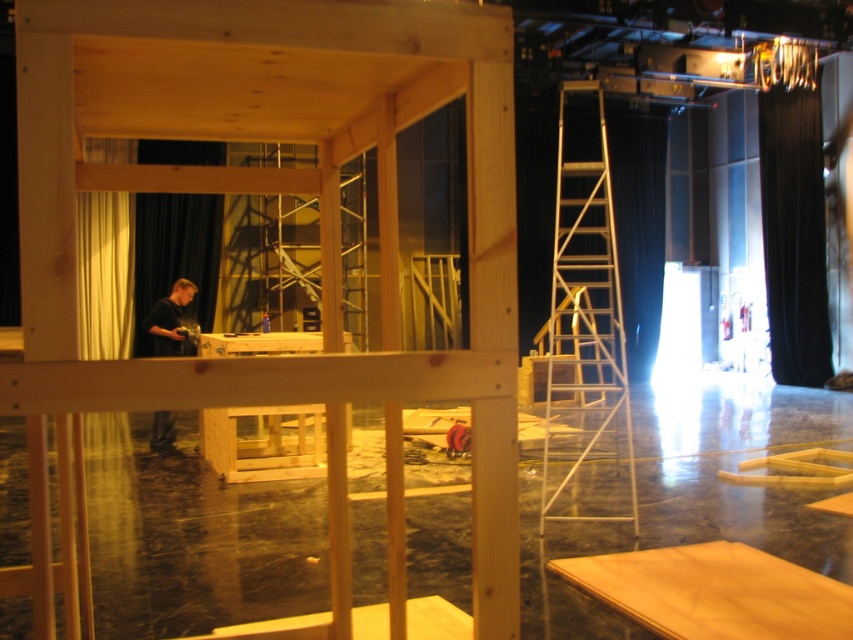
You are standing in the construction area and want to reach both the point at coordinates (589, 147) and the point at coordinates (173, 282). Which point is closer to you?

Point at coordinates (589, 147) is closer to you because it is further to the viewer than point at coordinates (173, 282).